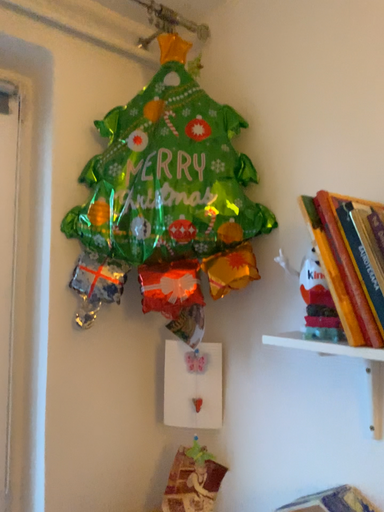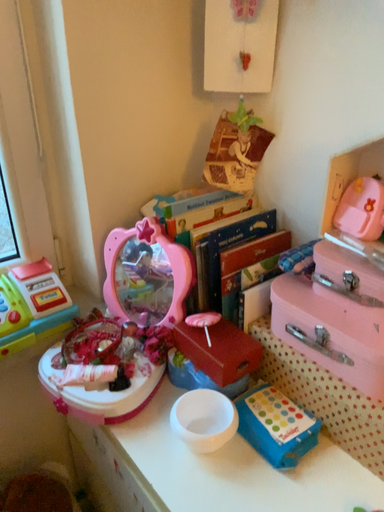
Question: Which way did the camera rotate in the video?

Choices:
 (A) rotated downward
 (B) rotated upward

Answer: (A)